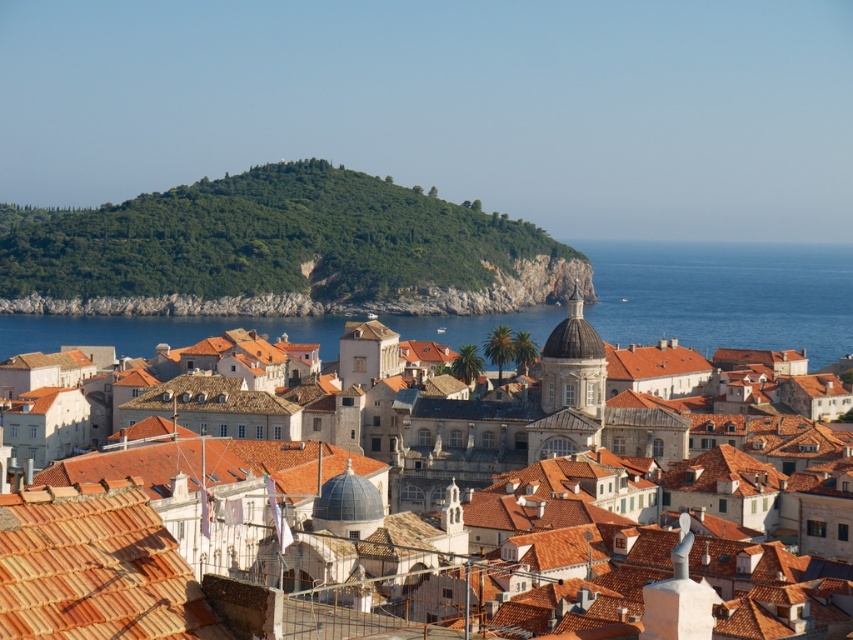
Does terracotta tiles at lower left have a larger size compared to blue water at center?

No.

Is point (32, 616) less distant than point (729, 320)?

Yes, point (32, 616) is closer to viewer.

Identify the location of terracotta tiles at lower left. This screenshot has width=853, height=640. (96, 572).

Between blue water at center and matte orange tile roofs at center, which one is positioned higher?

blue water at center is above.

Does point (699, 291) come farther from viewer compared to point (148, 477)?

Yes, point (699, 291) is behind point (148, 477).

Image resolution: width=853 pixels, height=640 pixels. Identify the location of blue water at center. (724, 296).

This screenshot has height=640, width=853. Find the location of `blue water at center`. blue water at center is located at coordinates (724, 296).

Does terracotta tiles at lower left lie in front of matte orange tile roofs at center?

Yes, it is.

Which is behind, point (91, 557) or point (239, 605)?

The point (239, 605) is behind.

The image size is (853, 640). In order to click on terracotta tiles at lower left in this screenshot , I will do `click(96, 572)`.